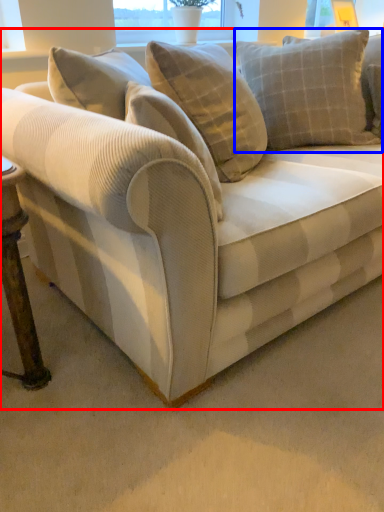
Question: Which object is closer to the camera taking this photo, studio couch (highlighted by a red box) or pillow (highlighted by a blue box)?

Choices:
 (A) studio couch
 (B) pillow

Answer: (A)